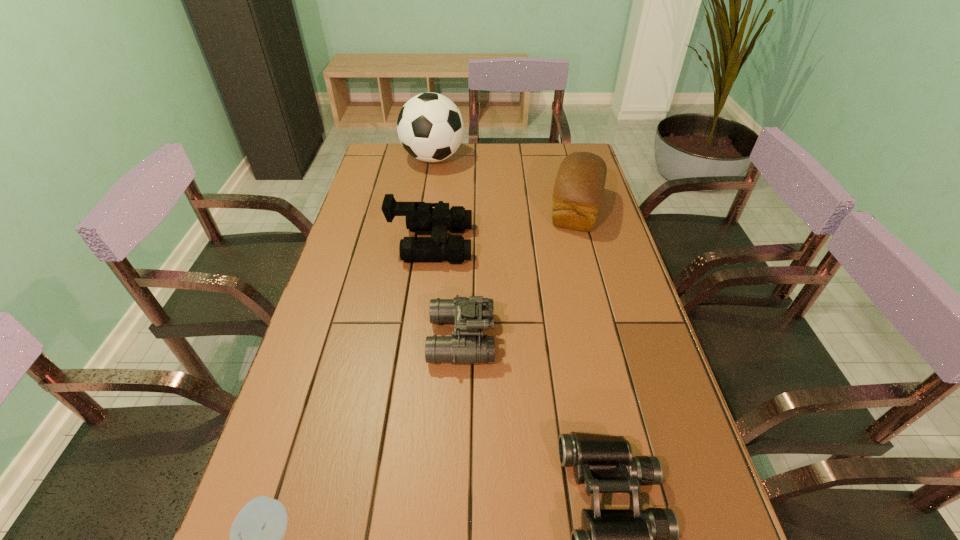
Identify the location of free space between the soccer ball and the tallest binoculars. This screenshot has height=540, width=960. (432, 201).

This screenshot has width=960, height=540. Find the location of `vacant area that lies between the bread and the second shortest binoculars`. vacant area that lies between the bread and the second shortest binoculars is located at coordinates (519, 274).

Locate which object is the second closest to the farthest object. Please provide its 2D coordinates. Your answer should be formatted as a tuple, i.e. [(x, y)], where the tuple contains the x and y coordinates of a point satisfying the conditions above.

[(579, 186)]

Locate which object is the second closest to the soccer ball. Please provide its 2D coordinates. Your answer should be formatted as a tuple, i.e. [(x, y)], where the tuple contains the x and y coordinates of a point satisfying the conditions above.

[(579, 186)]

Select which binoculars appears as the second closest to the nearest binoculars. Please provide its 2D coordinates. Your answer should be formatted as a tuple, i.e. [(x, y)], where the tuple contains the x and y coordinates of a point satisfying the conditions above.

[(421, 218)]

This screenshot has width=960, height=540. What are the coordinates of `binoculars that can be found as the second closest to the apple` in the screenshot? It's located at (629, 539).

Identify the location of vacant space that satisfies the following two spatial constraints: 1. on the front side of the bread; 2. through the lenses of the fourth farthest object. The image size is (960, 540). (612, 339).